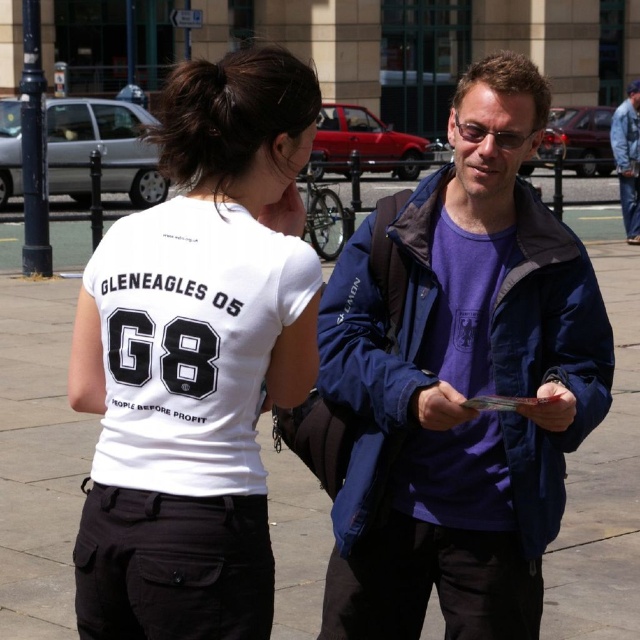
Question: Which point is farther to the camera?

Choices:
 (A) smooth concrete pavement at center
 (B) denim jacket at upper right
 (C) white matte jersey at center

Answer: (B)

Question: Observing the image, what is the correct spatial positioning of purple softshell jacket at center in reference to white matte jersey at center?

Choices:
 (A) right
 (B) left

Answer: (A)

Question: Can you confirm if white cotton t-shirt at upper left is positioned to the left of white matte jersey at center?

Choices:
 (A) no
 (B) yes

Answer: (B)

Question: Considering the real-world distances, which object is closest to the white matte jersey at center?

Choices:
 (A) white cotton t-shirt at upper left
 (B) smooth concrete pavement at center
 (C) denim jacket at upper right

Answer: (A)

Question: Which point appears farthest from the camera in this image?

Choices:
 (A) (164, 413)
 (B) (451, 378)

Answer: (B)

Question: Can you confirm if purple softshell jacket at center is positioned below denim jacket at upper right?

Choices:
 (A) no
 (B) yes

Answer: (B)